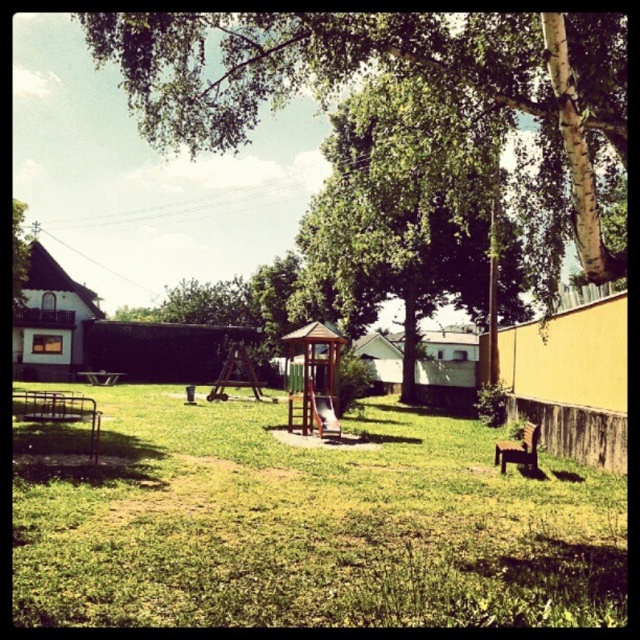
You are a gardener who needs to water the green grassy at center and the green leafy tree at center. If you start from the left side of the yard, which object should you water first?

The green grassy at center should be watered first since it is located to the left of the green leafy tree at center.

You are standing at the center of the grassy lawn and want to shade yourself from the sun. The green leafy tree at upper center is located at coordinates point 0.106, 0.613. Can you walk directly towards it from your current position without any obstacles?

The green leafy tree at upper center is located at point (x=392, y=67). Since there are no obstacles mentioned between your current position and the tree, you can walk directly towards it.

You are a gardener who needs to water the green grassy at center. You have a hose that can reach 2 meters. The wooden picnic table at lower left is in your way. Can you water the grass without moving the table?

The green grassy at center is in front of the wooden picnic table at lower left, meaning the table is between you and the grass. Since the hose can only reach 2 meters, you need to check the distance between you and the grass. If the table is within 2 meters, you might not be able to reach. But since the description doesn not specify distance, we can assume the table is close enough that the hose can still reach the grass beyond it. Alternatively, you could move the table temporarily for better access.